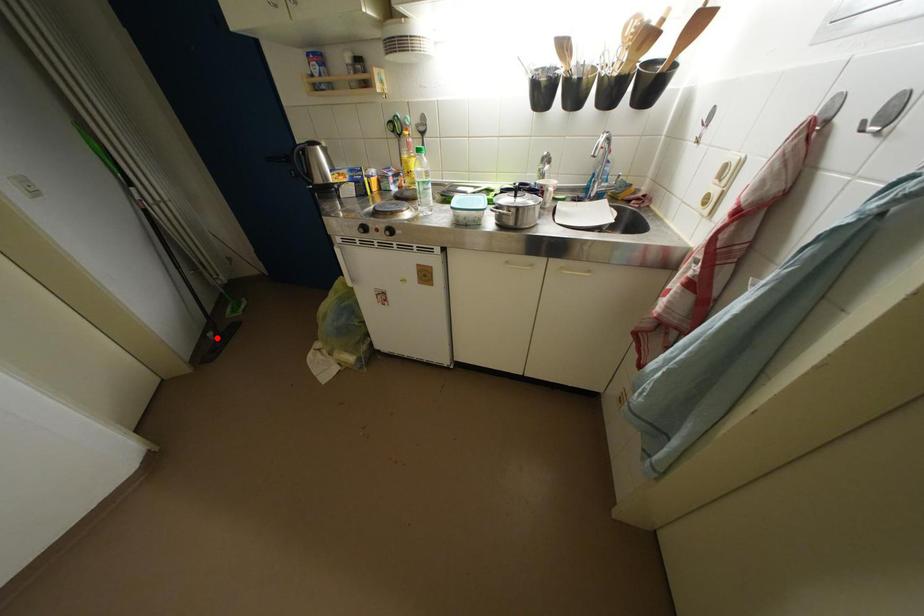
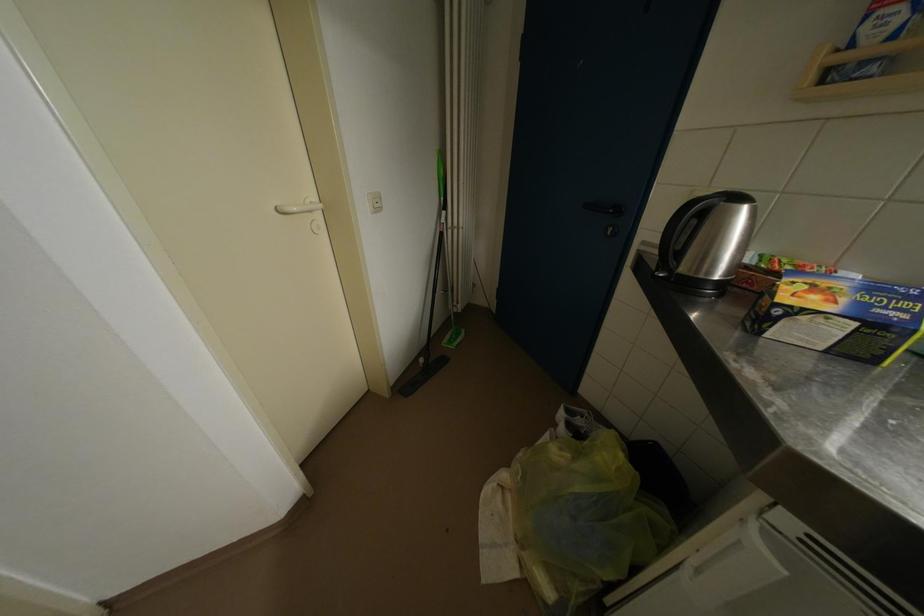
Question: I am providing you with two images of the same scene from different viewpoints. In image1, a red point is highlighted. Considering the same 3D point in image2, which of the following is correct?

Choices:
 (A) It is closer
 (B) It is farther

Answer: (B)